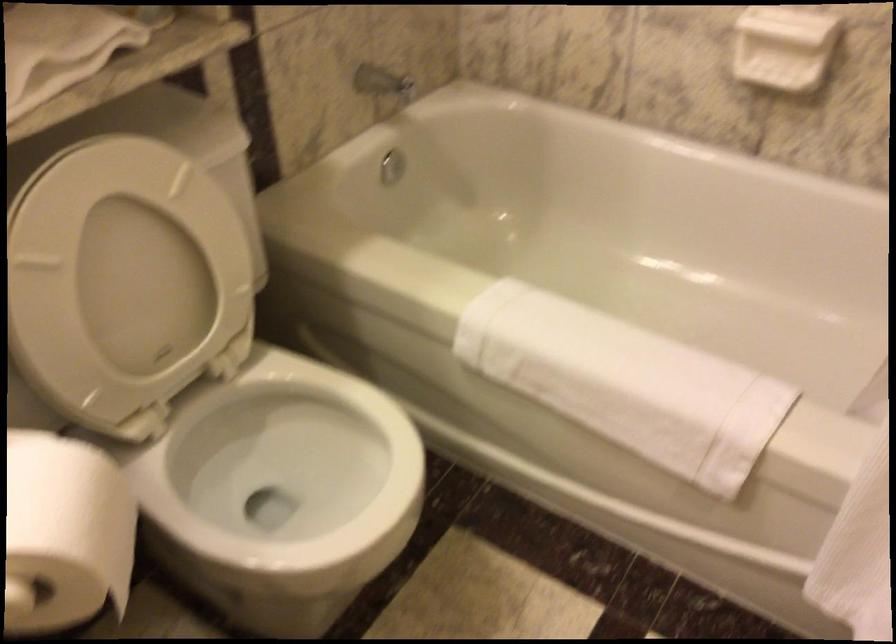
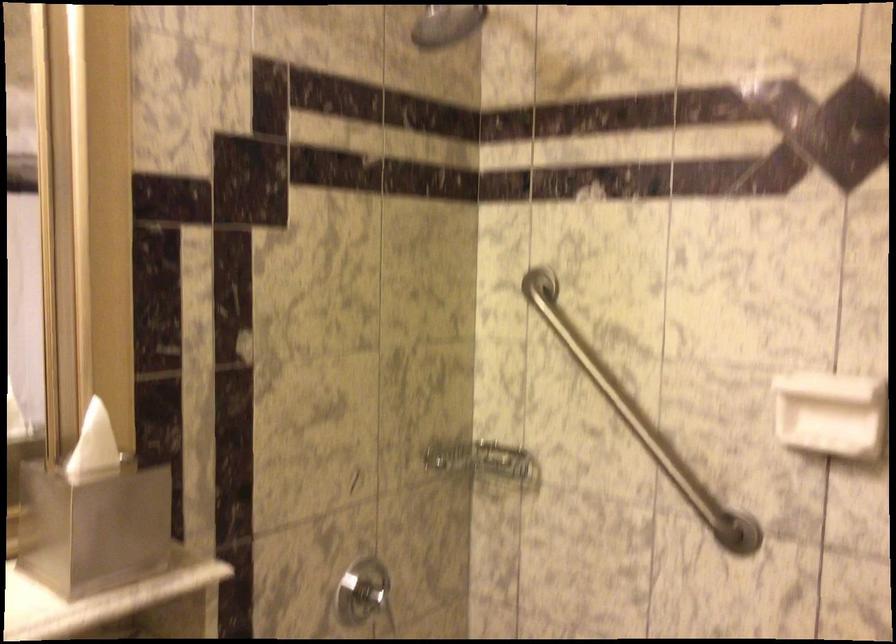
Question: The images are taken continuously from a first-person perspective. In which direction is your viewpoint rotating?

Choices:
 (A) Left
 (B) Right
 (C) Up
 (D) Down

Answer: (C)